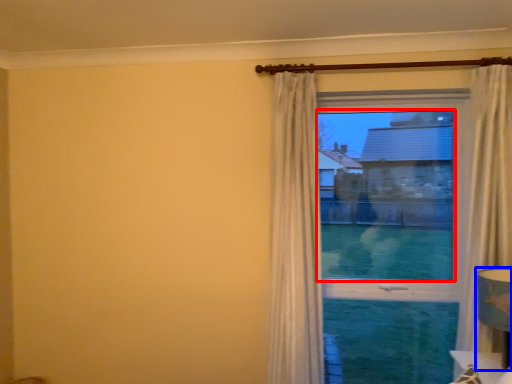
Question: Which point is further to the camera, window screen (highlighted by a red box) or table lamp (highlighted by a blue box)?

Choices:
 (A) window screen
 (B) table lamp

Answer: (A)